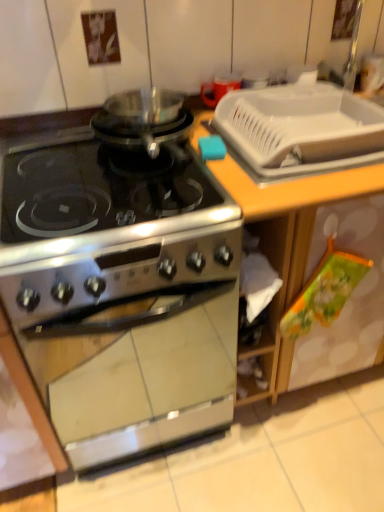
Where is `vacant space situated above white plastic tray at upper right (from a real-world perspective)`? vacant space situated above white plastic tray at upper right (from a real-world perspective) is located at coordinates (301, 128).